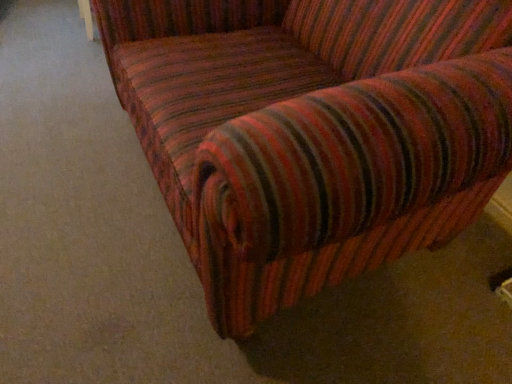
In order to face striped fabric couch at lower right, should I rotate leftwards or rightwards?

Turn left approximately 10.005 degrees to face it.

Identify the location of striped fabric couch at lower right. This screenshot has width=512, height=384. (312, 132).

The width and height of the screenshot is (512, 384). Describe the element at coordinates (312, 132) in the screenshot. I see `striped fabric couch at lower right` at that location.

Locate an element on the screen. The width and height of the screenshot is (512, 384). striped fabric couch at lower right is located at coordinates (312, 132).